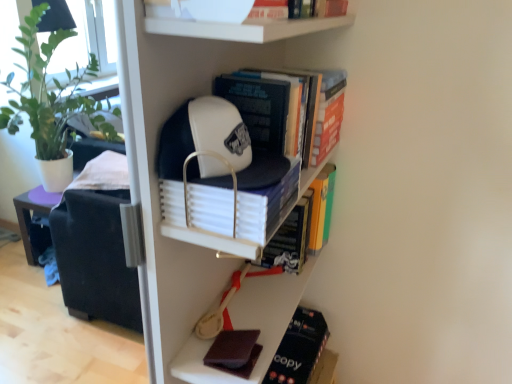
Question: Considering the relative sizes of hardcover book at center, which is the third book from top to bottom, and white matte book at center, positioned as the 4th book in top-to-bottom order, in the image provided, is hardcover book at center, which is the third book from top to bottom, thinner than white matte book at center, positioned as the 4th book in top-to-bottom order,?

Choices:
 (A) yes
 (B) no

Answer: (A)

Question: Is hardcover book at center, which is the third book from top to bottom, shorter than white matte book at center, the third book from the bottom?

Choices:
 (A) no
 (B) yes

Answer: (A)

Question: Is hardcover book at center, which is the fourth book in bottom-to-top order, to the left of white matte book at center, the third book from the bottom, from the viewer's perspective?

Choices:
 (A) yes
 (B) no

Answer: (B)

Question: Are hardcover book at center, which is the fourth book in bottom-to-top order, and white matte book at center, the third book from the bottom, located far from each other?

Choices:
 (A) no
 (B) yes

Answer: (A)

Question: Does hardcover book at center, which is the third book from top to bottom, have a smaller size compared to white matte book at center, positioned as the 4th book in top-to-bottom order?

Choices:
 (A) no
 (B) yes

Answer: (A)

Question: Does point (292, 375) appear closer or farther from the camera than point (178, 3)?

Choices:
 (A) closer
 (B) farther

Answer: (B)

Question: Relative to white matte bowl at upper center, acting as the 6th book starting from the bottom, is dark brown leather book at lower right, acting as the first book starting from the bottom, in front or behind?

Choices:
 (A) behind
 (B) front

Answer: (A)

Question: Choose the correct answer: Is dark brown leather book at lower right, acting as the first book starting from the bottom, inside white matte bowl at upper center, the 1th book viewed from the top, or outside it?

Choices:
 (A) outside
 (B) inside

Answer: (A)

Question: From a real-world perspective, relative to white matte bowl at upper center, acting as the 6th book starting from the bottom, is dark brown leather book at lower right, positioned as the sixth book in top-to-bottom order, vertically above or below?

Choices:
 (A) below
 (B) above

Answer: (A)

Question: Considering the positions of hardcover book at center, which is the fourth book in bottom-to-top order, and dark brown leather book at lower right, acting as the first book starting from the bottom, in the image, is hardcover book at center, which is the fourth book in bottom-to-top order, wider or thinner than dark brown leather book at lower right, acting as the first book starting from the bottom,?

Choices:
 (A) wide
 (B) thin

Answer: (B)

Question: From a real-world perspective, is hardcover book at center, which is the third book from top to bottom, positioned above or below dark brown leather book at lower right, acting as the first book starting from the bottom?

Choices:
 (A) below
 (B) above

Answer: (B)

Question: Is hardcover book at center, which is the fourth book in bottom-to-top order, taller or shorter than dark brown leather book at lower right, acting as the first book starting from the bottom?

Choices:
 (A) tall
 (B) short

Answer: (A)

Question: In the image, is hardcover book at center, which is the fourth book in bottom-to-top order, on the left side or the right side of dark brown leather book at lower right, acting as the first book starting from the bottom?

Choices:
 (A) right
 (B) left

Answer: (B)

Question: Do you think dark brown matte book at lower center is within white matte baseball cap at upper center, or outside of it?

Choices:
 (A) inside
 (B) outside

Answer: (A)

Question: Looking at their shapes, would you say dark brown matte book at lower center is wider or thinner than white matte baseball cap at upper center?

Choices:
 (A) wide
 (B) thin

Answer: (B)